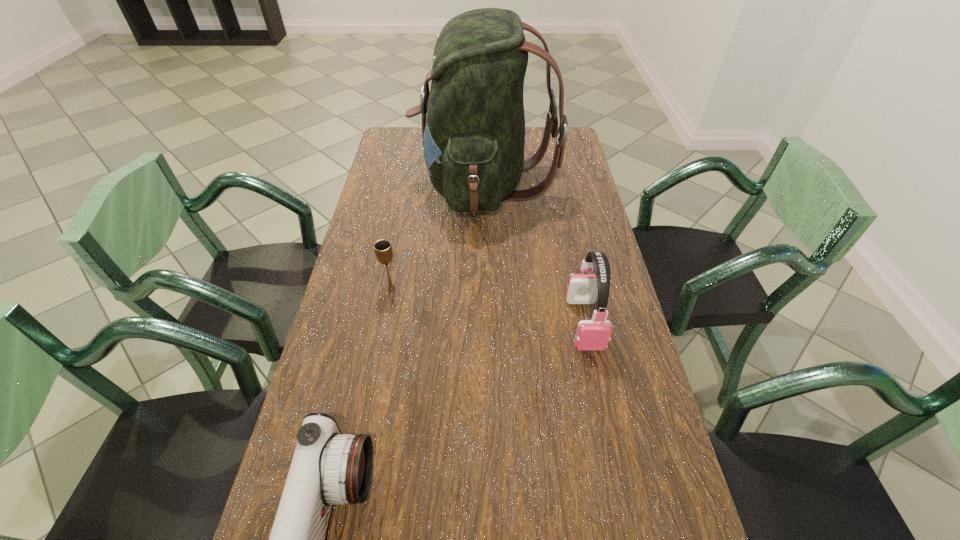
I want to click on the tallest object, so [473, 124].

Image resolution: width=960 pixels, height=540 pixels. I want to click on the farthest object, so click(473, 124).

What are the coordinates of `earphone` in the screenshot? It's located at (592, 335).

Where is `the third shortest object`? the third shortest object is located at coordinates (592, 335).

Where is `chalice`? This screenshot has width=960, height=540. chalice is located at coordinates (383, 250).

Find the location of a particular element. The image size is (960, 540). vacant region located 0.130m on the open flap of the backpack is located at coordinates (377, 185).

At what (x,y) coordinates should I click in order to perform the action: click on vacant space located on the open flap of the backpack. Please return your answer as a coordinate pair (x, y). Looking at the image, I should click on (395, 185).

Where is `blank space located on the open flap of the backpack`? blank space located on the open flap of the backpack is located at coordinates (380, 185).

I want to click on free space located 0.320m on the outer surface of the third farthest object, so click(619, 488).

Where is `vacant space located 0.220m on the front of the second farthest object`? vacant space located 0.220m on the front of the second farthest object is located at coordinates (377, 362).